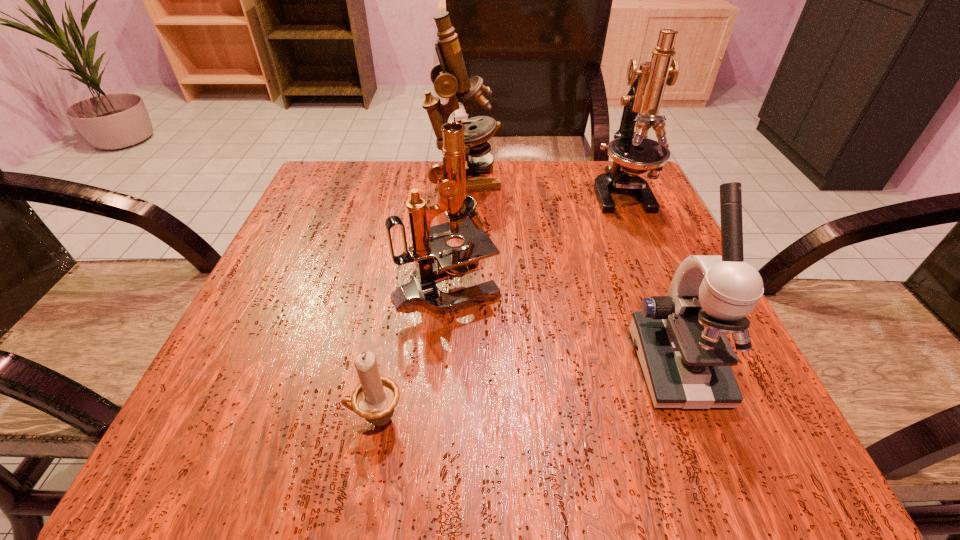
In the image, there is a desktop. Find the location of `vacant space at the near edge`. vacant space at the near edge is located at coordinates (478, 448).

In order to click on vacant space at the left edge of the desktop in this screenshot , I will do (334, 312).

The height and width of the screenshot is (540, 960). Identify the location of free region at the right edge. point(611,232).

Where is `free space at the far left corner`? Image resolution: width=960 pixels, height=540 pixels. free space at the far left corner is located at coordinates (367, 210).

Image resolution: width=960 pixels, height=540 pixels. Identify the location of free space at the near left corner of the desktop. (294, 472).

This screenshot has height=540, width=960. Find the location of `vacant area at the far right corner of the desktop`. vacant area at the far right corner of the desktop is located at coordinates (628, 193).

Find the location of a particular element. free space between the shortest object and the third farthest object is located at coordinates (411, 351).

Identify the location of empty location between the nearest microscope and the shortest object. (526, 393).

Select which object is the third closest to the shortest object. Please provide its 2D coordinates. Your answer should be formatted as a tuple, i.e. [(x, y)], where the tuple contains the x and y coordinates of a point satisfying the conditions above.

[(450, 78)]

This screenshot has height=540, width=960. I want to click on object identified as the closest to the third farthest microscope, so [x=375, y=397].